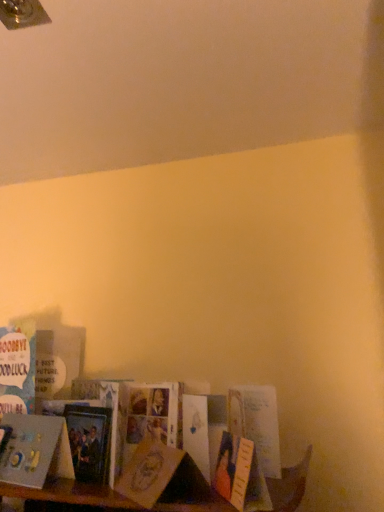
Question: In terms of size, does blue paper card at lower left, which is the first book from back to front, appear bigger or smaller than matte paper card at lower left, which is the 1th paperback book from right to left?

Choices:
 (A) big
 (B) small

Answer: (A)

Question: From the image's perspective, relative to matte paper card at lower left, which is the first paperback book from front to back, is blue paper card at lower left, which is the first book from back to front, above or below?

Choices:
 (A) above
 (B) below

Answer: (A)

Question: Which object is positioned closest to the white matte card at lower left, placed as the first book when sorted from front to back?

Choices:
 (A) matte black book at lower left, the 1th paperback book when ordered from back to front
 (B) blue paper card at lower left, which is the 2th book from front to back
 (C) matte paper card at lower left, which is the 1th paperback book from right to left

Answer: (A)

Question: Which of these objects is positioned farthest from the matte paper card at lower left, which is the first paperback book from front to back?

Choices:
 (A) white matte card at lower left, positioned as the 2th book in back-to-front order
 (B) matte black book at lower left, which is the 2th paperback book from front to back
 (C) blue paper card at lower left, which is the first book from back to front

Answer: (C)